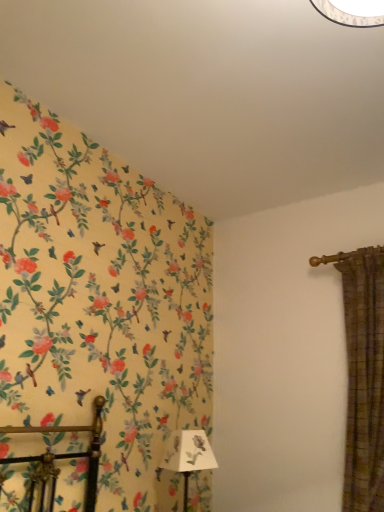
Where is `white paper lampshade at lower center`? The image size is (384, 512). white paper lampshade at lower center is located at coordinates (188, 456).

What do you see at coordinates (188, 456) in the screenshot? I see `white paper lampshade at lower center` at bounding box center [188, 456].

Describe the element at coordinates (364, 378) in the screenshot. I see `green plaid curtain at right` at that location.

Identify the location of green plaid curtain at right. The image size is (384, 512). (364, 378).

Find the location of a particular element. white paper lampshade at lower center is located at coordinates [188, 456].

Considering the relative positions of white paper lampshade at lower center and green plaid curtain at right in the image provided, is white paper lampshade at lower center to the left or to the right of green plaid curtain at right?

Based on their positions, white paper lampshade at lower center is located to the left of green plaid curtain at right.

Is white paper lampshade at lower center in front of or behind green plaid curtain at right in the image?

white paper lampshade at lower center is behind green plaid curtain at right.

Considering the points (188, 441) and (362, 455), which point is in front, point (188, 441) or point (362, 455)?

The point (362, 455) is closer.

From the picture: From the image's perspective, is white paper lampshade at lower center on green plaid curtain at right?

No.

From a real-world perspective, does white paper lampshade at lower center sit lower than green plaid curtain at right?

Indeed, from a real-world perspective, white paper lampshade at lower center is positioned beneath green plaid curtain at right.

Which of these two, white paper lampshade at lower center or green plaid curtain at right, is thinner?

Thinner between the two is white paper lampshade at lower center.

Who is taller, white paper lampshade at lower center or green plaid curtain at right?

green plaid curtain at right.

Who is bigger, white paper lampshade at lower center or green plaid curtain at right?

Bigger between the two is green plaid curtain at right.

Which is correct: white paper lampshade at lower center is inside green plaid curtain at right, or outside of it?

white paper lampshade at lower center is located beyond the bounds of green plaid curtain at right.

Is white paper lampshade at lower center placed right next to green plaid curtain at right?

They are not placed beside each other.

Is white paper lampshade at lower center aimed at green plaid curtain at right?

No, white paper lampshade at lower center is not turned towards green plaid curtain at right.

The image size is (384, 512). What are the coordinates of `curtain on the right of white paper lampshade at lower center` in the screenshot? It's located at (364, 378).

Considering the relative positions of green plaid curtain at right and white paper lampshade at lower center in the image provided, is green plaid curtain at right to the right of white paper lampshade at lower center from the viewer's perspective?

Indeed, green plaid curtain at right is positioned on the right side of white paper lampshade at lower center.

Is green plaid curtain at right positioned before white paper lampshade at lower center?

Yes, it is in front of white paper lampshade at lower center.

Which is closer to the camera, (x=362, y=410) or (x=176, y=439)?

Clearly, point (x=362, y=410) is closer to the camera than point (x=176, y=439).

From the picture: From the image's perspective, is green plaid curtain at right above or below white paper lampshade at lower center?

Based on their image positions, green plaid curtain at right is located above white paper lampshade at lower center.

From a real-world perspective, is green plaid curtain at right positioned above or below white paper lampshade at lower center?

From a real-world perspective, green plaid curtain at right is physically above white paper lampshade at lower center.

Is green plaid curtain at right wider than white paper lampshade at lower center?

Yes.

Who is taller, green plaid curtain at right or white paper lampshade at lower center?

With more height is green plaid curtain at right.

Who is smaller, green plaid curtain at right or white paper lampshade at lower center?

With smaller size is white paper lampshade at lower center.

Choose the correct answer: Is green plaid curtain at right inside white paper lampshade at lower center or outside it?

green plaid curtain at right is not inside white paper lampshade at lower center, it's outside.

Is green plaid curtain at right with white paper lampshade at lower center?

No, green plaid curtain at right is not touching white paper lampshade at lower center.

Does green plaid curtain at right turn towards white paper lampshade at lower center?

No, green plaid curtain at right is not facing towards white paper lampshade at lower center.

Locate an element on the screen. curtain that is above the white paper lampshade at lower center (from the image's perspective) is located at coordinates (364, 378).

You are a GUI agent. You are given a task and a screenshot of the screen. Output one action in this format:
    pyautogui.click(x=<x>, y=<y>)
    Task: Click on the table lamp lying below the green plaid curtain at right (from the image's perspective)
    This screenshot has width=384, height=512.
    Given the screenshot: What is the action you would take?
    pyautogui.click(x=188, y=456)

Find the location of `curtain in front of the white paper lampshade at lower center`. curtain in front of the white paper lampshade at lower center is located at coordinates (364, 378).